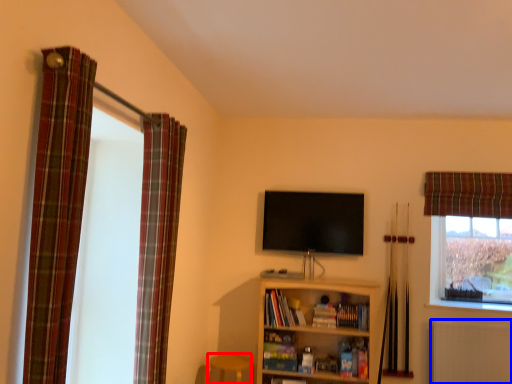
Question: Which of the following is the farthest to the observer, bar stool (highlighted by a red box) or radiator (highlighted by a blue box)?

Choices:
 (A) bar stool
 (B) radiator

Answer: (B)